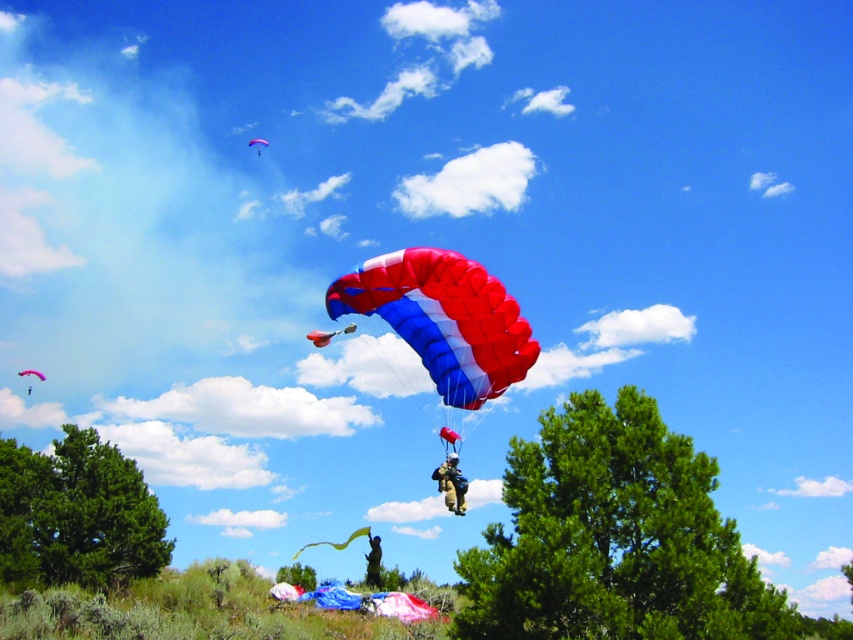
You are a skydiver who has just landed in this area. You see a camouflage fabric parachute at center and a yellow fabric parachute at center. Which parachute is positioned to the right side from your perspective?

The camouflage fabric parachute at center is positioned to the right of the yellow fabric parachute at center.